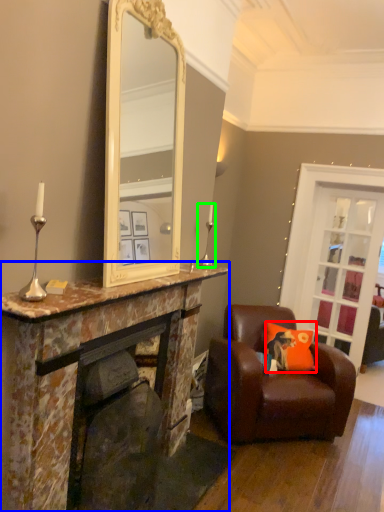
Question: Which is farther away from cushion (highlighted by a red box)? cabinetry (highlighted by a blue box) or candle holder (highlighted by a green box)?

Choices:
 (A) cabinetry
 (B) candle holder

Answer: (A)